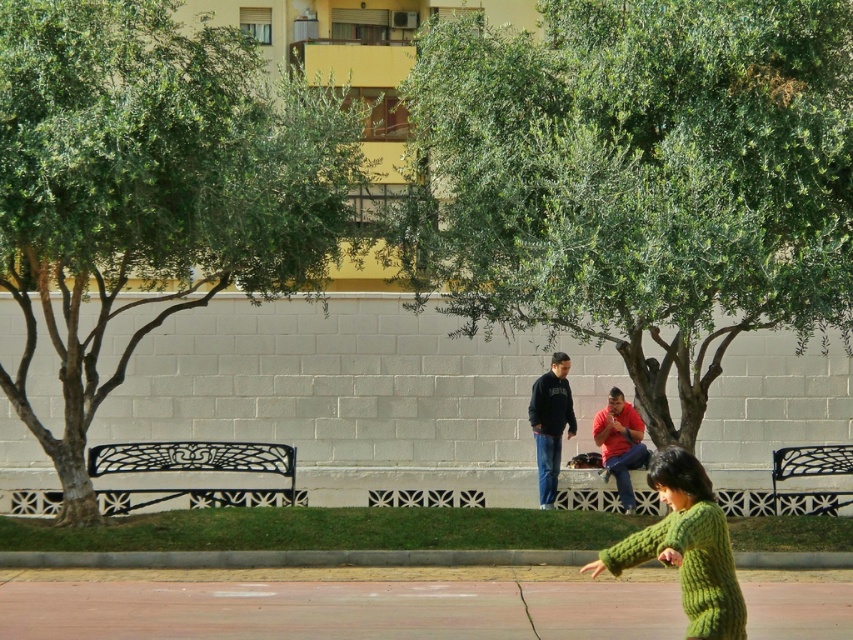
You are a gardener who needs to water the green leafy tree at left and the white wrought iron bench at lower left. The watering can you have can reach 10 feet. Can you water both without moving the can?

The green leafy tree at left and the white wrought iron bench at lower left are 9.10 feet apart, so yes, the watering can can reach both since the distance between them is within the 10 feet range.

You are standing at the entrance of the park and see the dark blue sweatshirt at center. Can you estimate how far it is from your current position?

The dark blue sweatshirt at center is located at point (550, 422) in coordinates, which suggests it is approximately 64.6 meters away from your current position.